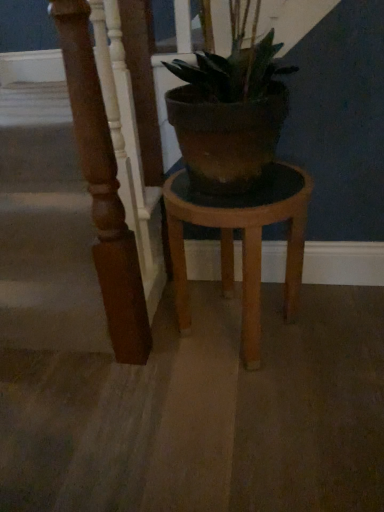
Question: Is there a large distance between brown polished wood pillar at left and wooden stool at center?

Choices:
 (A) no
 (B) yes

Answer: (A)

Question: Is brown polished wood pillar at left to the right of wooden stool at center from the viewer's perspective?

Choices:
 (A) yes
 (B) no

Answer: (B)

Question: Can you confirm if brown polished wood pillar at left is bigger than wooden stool at center?

Choices:
 (A) yes
 (B) no

Answer: (B)

Question: Is brown polished wood pillar at left further to camera compared to wooden stool at center?

Choices:
 (A) no
 (B) yes

Answer: (A)

Question: From a real-world perspective, is brown polished wood pillar at left on wooden stool at center?

Choices:
 (A) yes
 (B) no

Answer: (A)

Question: Can you confirm if brown polished wood pillar at left is thinner than wooden stool at center?

Choices:
 (A) no
 (B) yes

Answer: (B)

Question: Considering the relative sizes of wooden stool at center and brown polished wood pillar at left in the image provided, is wooden stool at center smaller than brown polished wood pillar at left?

Choices:
 (A) yes
 (B) no

Answer: (B)

Question: From the image's perspective, is wooden stool at center located beneath brown polished wood pillar at left?

Choices:
 (A) yes
 (B) no

Answer: (A)

Question: From a real-world perspective, is wooden stool at center on brown polished wood pillar at left?

Choices:
 (A) no
 (B) yes

Answer: (A)

Question: Could you tell me if wooden stool at center is facing brown polished wood pillar at left?

Choices:
 (A) yes
 (B) no

Answer: (B)

Question: Is wooden stool at center oriented away from brown polished wood pillar at left?

Choices:
 (A) yes
 (B) no

Answer: (B)

Question: From a real-world perspective, is wooden stool at center positioned under brown polished wood pillar at left based on gravity?

Choices:
 (A) yes
 (B) no

Answer: (A)

Question: From a real-world perspective, is brown polished wood pillar at left physically located above or below wooden stool at center?

Choices:
 (A) below
 (B) above

Answer: (B)